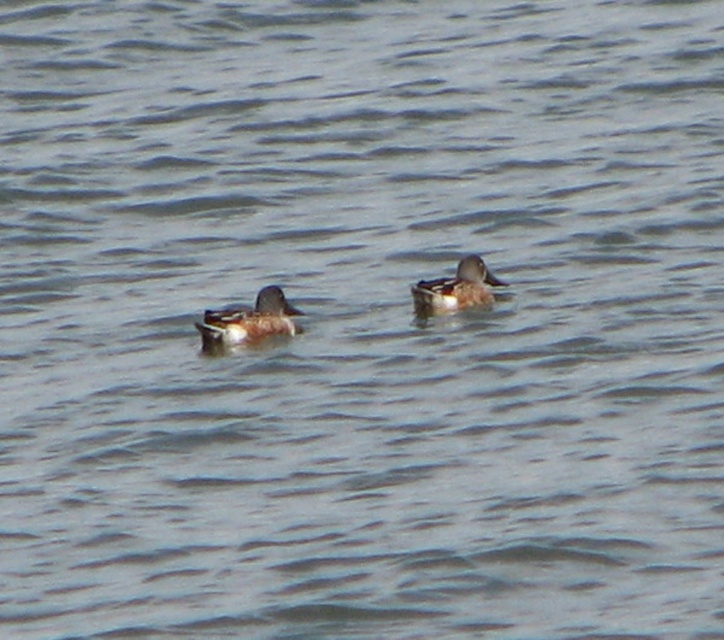
Question: Which of the following is the farthest from the observer?

Choices:
 (A) (272, 326)
 (B) (446, 296)

Answer: (B)

Question: Is brown matte duck at center thinner than brown speckled duck at center?

Choices:
 (A) no
 (B) yes

Answer: (B)

Question: Is brown matte duck at center wider than brown speckled duck at center?

Choices:
 (A) yes
 (B) no

Answer: (B)

Question: Which point is closer to the camera?

Choices:
 (A) brown matte duck at center
 (B) brown speckled duck at center

Answer: (A)

Question: Can you confirm if brown matte duck at center is thinner than brown speckled duck at center?

Choices:
 (A) yes
 (B) no

Answer: (A)